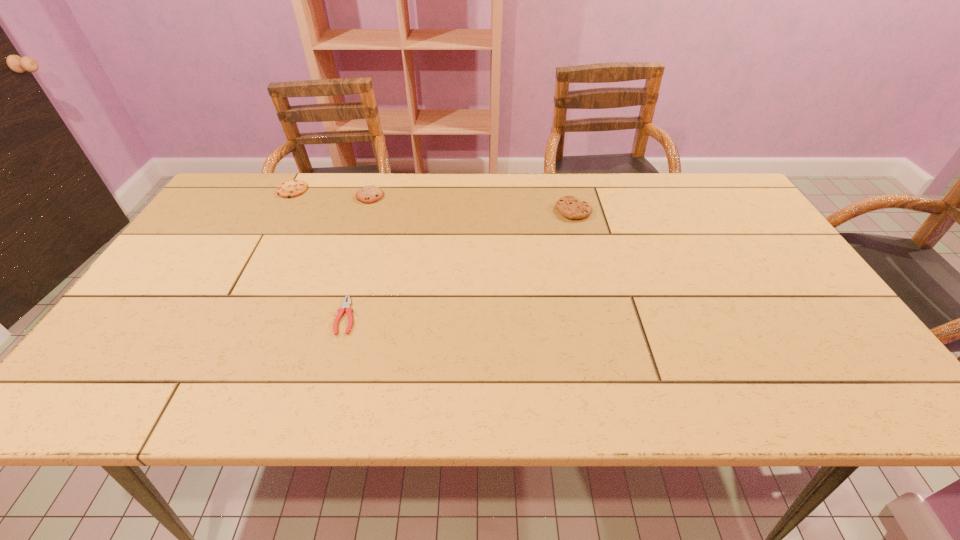
Locate an element on the screen. The height and width of the screenshot is (540, 960). vacant space located on the front of the leftmost cookie is located at coordinates (281, 210).

The image size is (960, 540). In order to click on vacant area situated 0.120m on the front of the nearest object in this screenshot , I will do `click(327, 383)`.

The width and height of the screenshot is (960, 540). What are the coordinates of `free space at the far edge of the desktop` in the screenshot? It's located at (309, 203).

Find the location of a particular element. The image size is (960, 540). vacant space at the near edge is located at coordinates (519, 380).

The height and width of the screenshot is (540, 960). In the image, there is a desktop. What are the coordinates of `vacant space at the left edge` in the screenshot? It's located at (132, 347).

Where is `vacant area at the right edge`? Image resolution: width=960 pixels, height=540 pixels. vacant area at the right edge is located at coordinates (785, 283).

Where is `vacant region at the far left corner`? vacant region at the far left corner is located at coordinates (249, 204).

Locate an element on the screen. The width and height of the screenshot is (960, 540). free region at the near right corner of the desktop is located at coordinates (852, 370).

The height and width of the screenshot is (540, 960). In order to click on free space that is in between the rightmost cookie and the pliers in this screenshot , I will do `click(460, 264)`.

Locate an element on the screen. Image resolution: width=960 pixels, height=540 pixels. empty space between the second shortest cookie and the leftmost cookie is located at coordinates [331, 193].